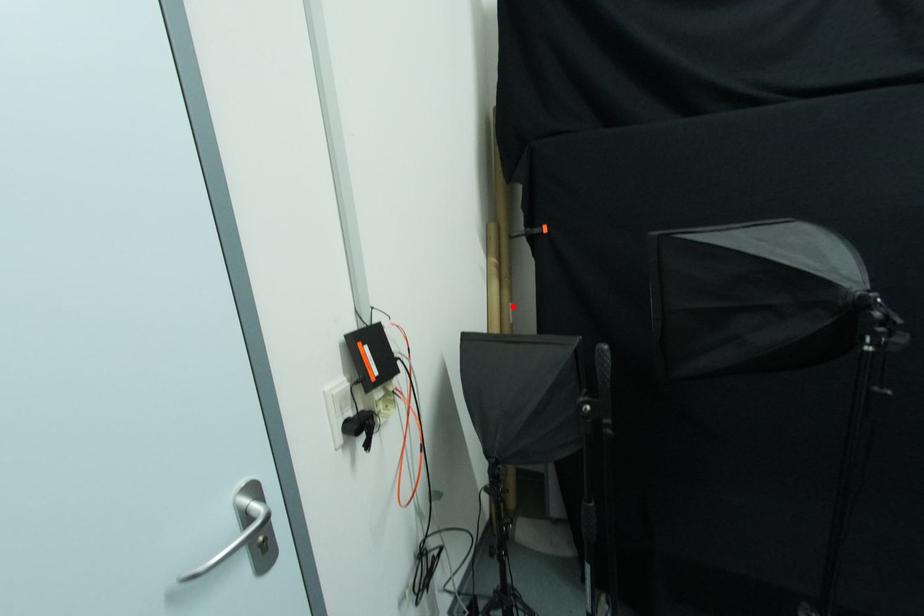
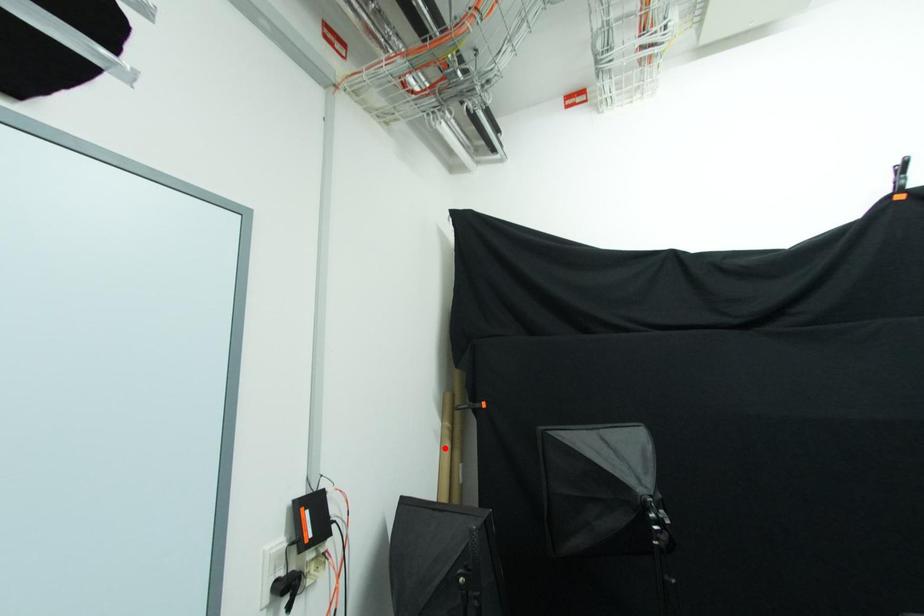
I am providing you with two images of the same scene from different viewpoints. A red point is marked on the first image and another point is marked on the second image. Does the point marked in image1 correspond to the same location as the one in image2?

No